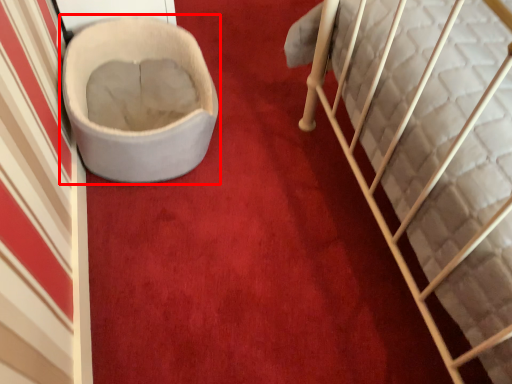
Question: Observing the image, what is the correct spatial positioning of toilet (annotated by the red box) in reference to furniture?

Choices:
 (A) left
 (B) right

Answer: (A)